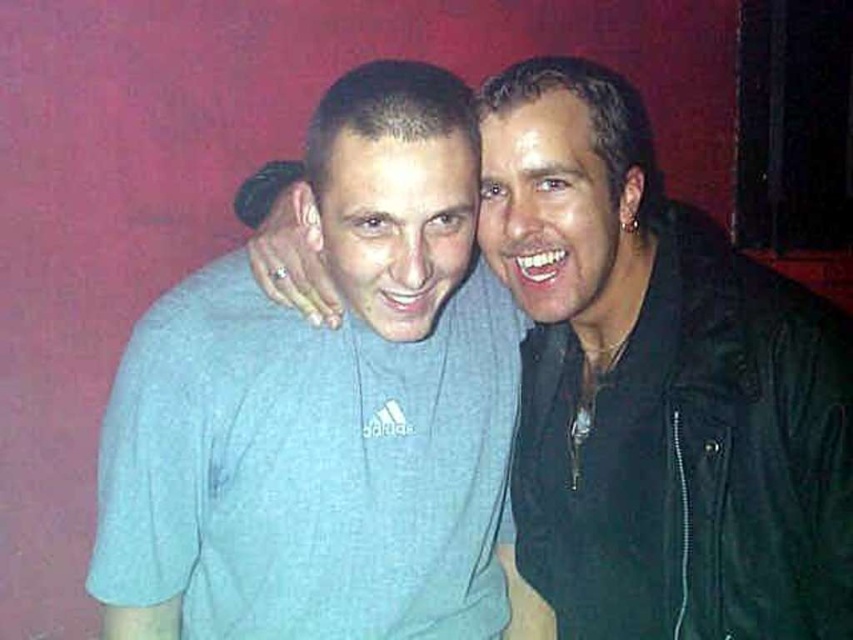
Question: Is the position of light blue cotton t-shirt at left less distant than that of light blue cotton t-shirt at center?

Choices:
 (A) yes
 (B) no

Answer: (B)

Question: Which of the following is the farthest from the observer?

Choices:
 (A) light blue cotton t-shirt at center
 (B) light blue cotton t-shirt at left

Answer: (B)

Question: Is light blue cotton t-shirt at left positioned behind light blue cotton t-shirt at center?

Choices:
 (A) yes
 (B) no

Answer: (A)

Question: Which object is closer to the camera taking this photo?

Choices:
 (A) light blue cotton t-shirt at left
 (B) light blue cotton t-shirt at center

Answer: (B)

Question: Which object appears farthest from the camera in this image?

Choices:
 (A) light blue cotton t-shirt at left
 (B) light blue cotton t-shirt at center

Answer: (A)

Question: Does light blue cotton t-shirt at left appear under light blue cotton t-shirt at center?

Choices:
 (A) yes
 (B) no

Answer: (A)